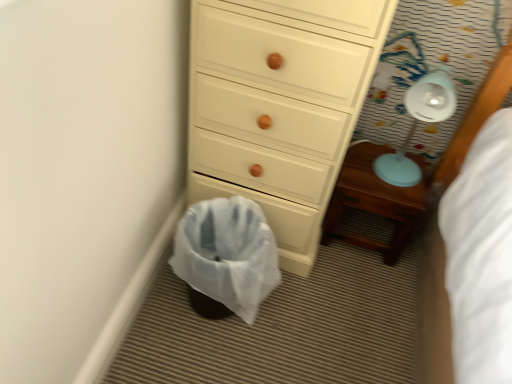
Question: Should I look upward or downward to see white plastic lamp at upper right?

Choices:
 (A) up
 (B) down

Answer: (A)

Question: Is white plastic laundry basket at lower center turned away from white wood chest of drawers at center?

Choices:
 (A) no
 (B) yes

Answer: (A)

Question: From a real-world perspective, is white plastic laundry basket at lower center under white wood chest of drawers at center?

Choices:
 (A) no
 (B) yes

Answer: (B)

Question: From the image's perspective, is white plastic laundry basket at lower center below white wood chest of drawers at center?

Choices:
 (A) yes
 (B) no

Answer: (A)

Question: Considering the relative sizes of white plastic laundry basket at lower center and white wood chest of drawers at center in the image provided, is white plastic laundry basket at lower center thinner than white wood chest of drawers at center?

Choices:
 (A) no
 (B) yes

Answer: (B)

Question: Can you confirm if white plastic laundry basket at lower center is shorter than white wood chest of drawers at center?

Choices:
 (A) no
 (B) yes

Answer: (B)

Question: Is white plastic laundry basket at lower center bigger than white wood chest of drawers at center?

Choices:
 (A) yes
 (B) no

Answer: (B)

Question: Is white plastic laundry basket at lower center smaller than white plastic lamp at upper right?

Choices:
 (A) no
 (B) yes

Answer: (A)

Question: Does white plastic laundry basket at lower center have a greater width compared to white plastic lamp at upper right?

Choices:
 (A) no
 (B) yes

Answer: (B)

Question: Considering the relative sizes of white plastic laundry basket at lower center and white plastic lamp at upper right in the image provided, is white plastic laundry basket at lower center taller than white plastic lamp at upper right?

Choices:
 (A) yes
 (B) no

Answer: (B)

Question: Considering the relative sizes of white plastic laundry basket at lower center and white plastic lamp at upper right in the image provided, is white plastic laundry basket at lower center bigger than white plastic lamp at upper right?

Choices:
 (A) yes
 (B) no

Answer: (A)

Question: Considering the relative positions of white plastic laundry basket at lower center and white plastic lamp at upper right in the image provided, is white plastic laundry basket at lower center to the left of white plastic lamp at upper right from the viewer's perspective?

Choices:
 (A) yes
 (B) no

Answer: (A)

Question: Is white plastic laundry basket at lower center thinner than white plastic lamp at upper right?

Choices:
 (A) no
 (B) yes

Answer: (A)

Question: From a real-world perspective, is white plastic lamp at upper right positioned over white wood chest of drawers at center based on gravity?

Choices:
 (A) no
 (B) yes

Answer: (B)